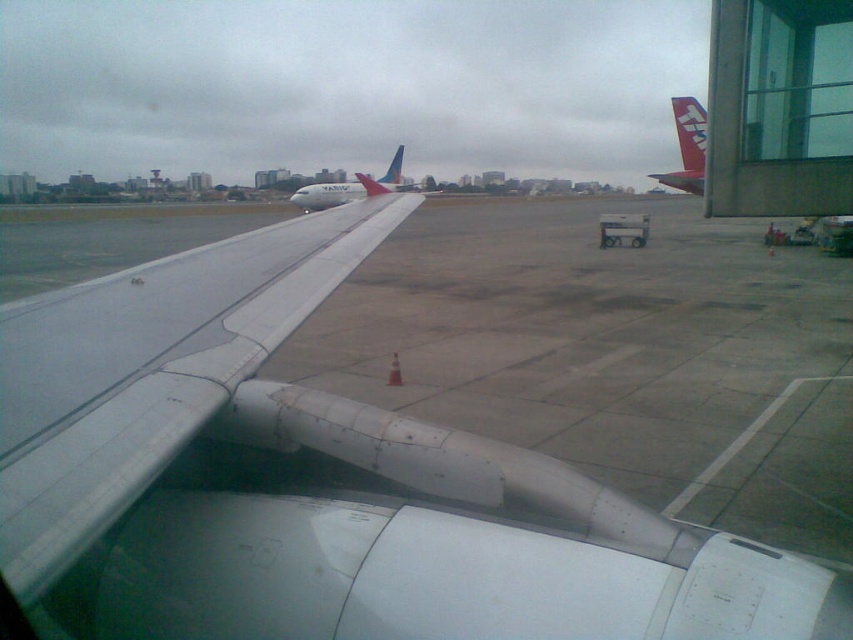
Can you confirm if matte red tail at upper right is bigger than white glossy airplane at center?

Yes.

Can you confirm if matte red tail at upper right is smaller than white glossy airplane at center?

No.

Who is more distant from viewer, (680,179) or (291,196)?

Positioned behind is point (291,196).

The height and width of the screenshot is (640, 853). In order to click on matte red tail at upper right in this screenshot , I will do `click(688, 147)`.

Based on the photo, does metallic silver wing at center appear under metallic gray wing at center?

Yes.

Between metallic silver wing at center and metallic gray wing at center, which one has more height?

metallic silver wing at center is taller.

Does point (387, 560) come farther from viewer compared to point (28, 310)?

No, it is in front of (28, 310).

This screenshot has height=640, width=853. Find the location of `metallic silver wing at center`. metallic silver wing at center is located at coordinates (320, 483).

Between metallic silver wing at center and white glossy airplane at center, which one has less height?

metallic silver wing at center is shorter.

Is metallic silver wing at center further to camera compared to white glossy airplane at center?

No, metallic silver wing at center is in front of white glossy airplane at center.

Does point (689, 636) come in front of point (311, 193)?

Yes.

The width and height of the screenshot is (853, 640). In order to click on metallic silver wing at center in this screenshot , I will do `click(320, 483)`.